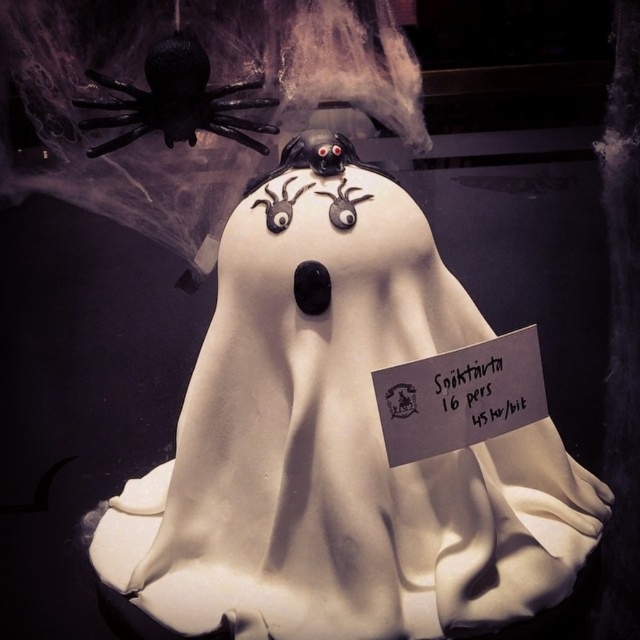
Can you confirm if white fondant ghost at center is bigger than black matte spider at upper left?

Correct, white fondant ghost at center is larger in size than black matte spider at upper left.

You are a GUI agent. You are given a task and a screenshot of the screen. Output one action in this format:
    pyautogui.click(x=<x>, y=<y>)
    Task: Click on the white fondant ghost at center
    This screenshot has width=640, height=640.
    Given the screenshot: What is the action you would take?
    pyautogui.click(x=339, y=440)

Find the location of a particular element. The width and height of the screenshot is (640, 640). white fondant ghost at center is located at coordinates (339, 440).

Is white fondant ghost at center above white paper sign at center?

Correct, white fondant ghost at center is located above white paper sign at center.

Locate an element on the screen. Image resolution: width=640 pixels, height=640 pixels. white fondant ghost at center is located at coordinates (339, 440).

Based on the photo, is the position of black matte spider at upper left more distant than that of white paper sign at center?

Yes, black matte spider at upper left is behind white paper sign at center.

Measure the distance between point [108,125] and camera.

Point [108,125] is 84.03 centimeters from camera.

Is point (177, 45) more distant than point (429, 385)?

Yes, point (177, 45) is farther from viewer.

Locate an element on the screen. black matte spider at upper left is located at coordinates (176, 100).